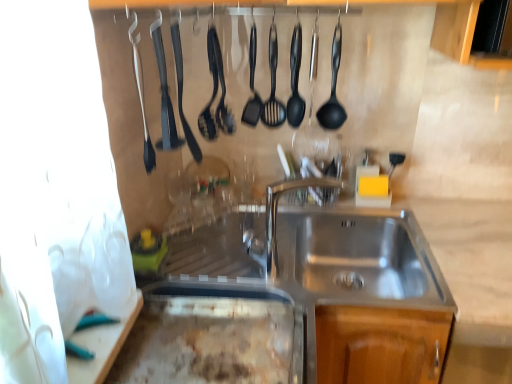
Question: Considering the relative positions of polished stainless steel faucet at center and black rubber spatula at upper center, acting as the 3th silverware starting from the left, in the image provided, is polished stainless steel faucet at center to the left or to the right of black rubber spatula at upper center, acting as the 3th silverware starting from the left,?

Choices:
 (A) left
 (B) right

Answer: (B)

Question: Looking at their shapes, would you say polished stainless steel faucet at center is wider or thinner than black rubber spatula at upper center, the 1th silverware in the right-to-left sequence?

Choices:
 (A) thin
 (B) wide

Answer: (A)

Question: Estimate the real-world distances between objects in this image. Which object is closer to the polished stainless steel faucet at center?

Choices:
 (A) black plastic spatula at center, which is counted as the 2th utensil, starting from the right
 (B) black rubber spatula at upper center, placed as the second silverware when sorted from left to right
 (C) black plastic spatula at center, which appears as the 1th utensil when viewed from the right
 (D) black rubber spatula at center, which is the third utensil from right to left
 (E) black rubber spatula at upper left, the first silverware when ordered from left to right

Answer: (C)

Question: Estimate the real-world distances between objects in this image. Which object is farther from the black rubber spatula at upper left, the first silverware when ordered from left to right?

Choices:
 (A) black rubber spatula at center, which is the third utensil from right to left
 (B) black plastic spatula at center, the 3th utensil in the left-to-right sequence
 (C) black rubber spatula at upper center, placed as the second silverware when sorted from left to right
 (D) black rubber spatula at upper center, the 1th silverware in the right-to-left sequence
 (E) polished stainless steel faucet at center

Answer: (E)